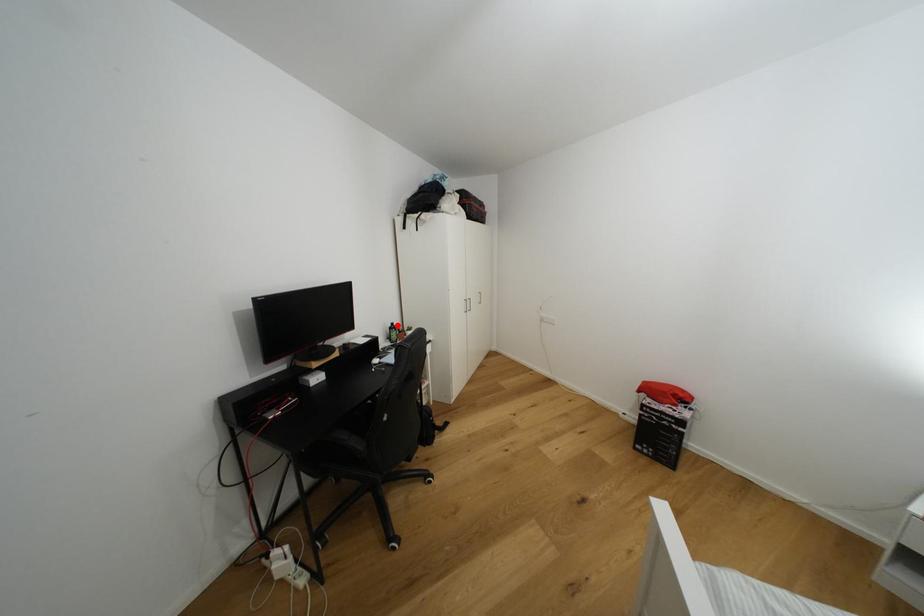
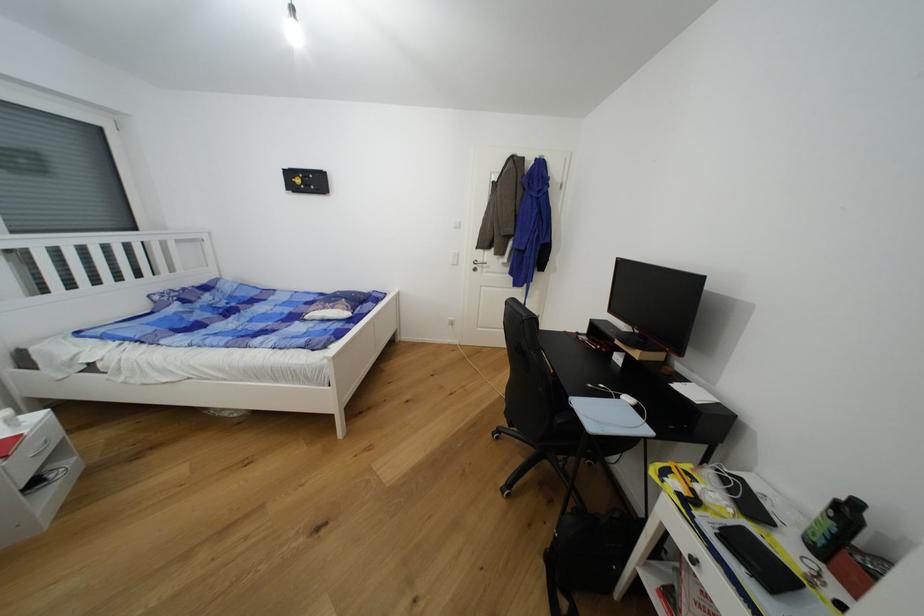
In the second image, find the point that corresponds to the highlighted location in the first image.

(862, 506)